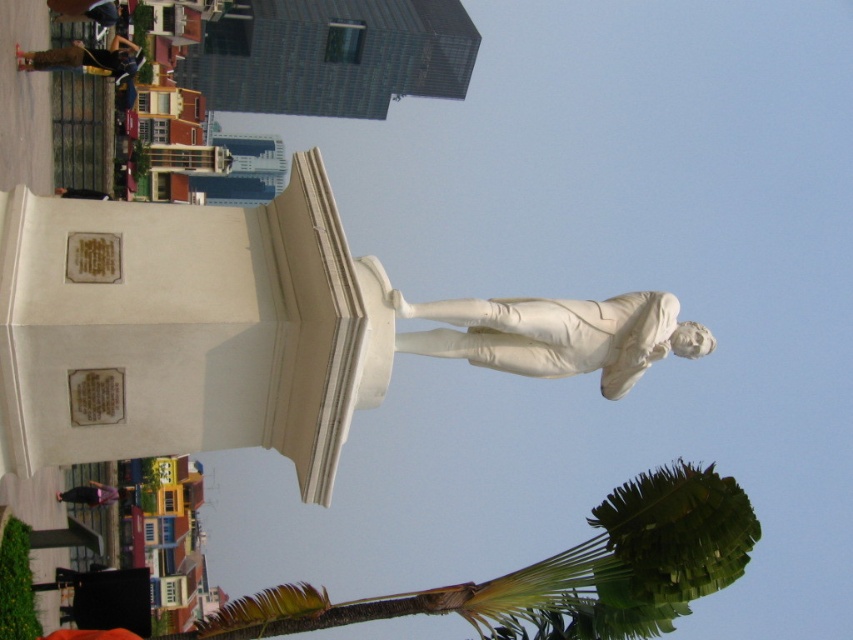
Which is more to the right, white marble statue at center or dark blue jeans at upper left?

white marble statue at center

Is white marble statue at center to the right of dark blue jeans at upper left from the viewer's perspective?

Correct, you'll find white marble statue at center to the right of dark blue jeans at upper left.

Where is `white marble statue at center`? This screenshot has height=640, width=853. white marble statue at center is located at coordinates (558, 333).

Who is shorter, green leafy palm at lower right or matte black jacket at upper left?

matte black jacket at upper left

This screenshot has height=640, width=853. What are the coordinates of `green leafy palm at lower right` in the screenshot? It's located at (556, 573).

Who is more distant from viewer, (589, 596) or (48, 8)?

Positioned behind is point (48, 8).

Find the location of a particular element. The image size is (853, 640). green leafy palm at lower right is located at coordinates (556, 573).

Does green leafy palm at lower right lie in front of dark blue jeans at upper left?

Yes.

Does green leafy palm at lower right have a larger size compared to dark blue jeans at upper left?

Yes, green leafy palm at lower right is bigger than dark blue jeans at upper left.

Between point (161, 637) and point (33, 61), which one is positioned behind?

The point (33, 61) is more distant.

Find the location of a particular element. The image size is (853, 640). green leafy palm at lower right is located at coordinates (556, 573).